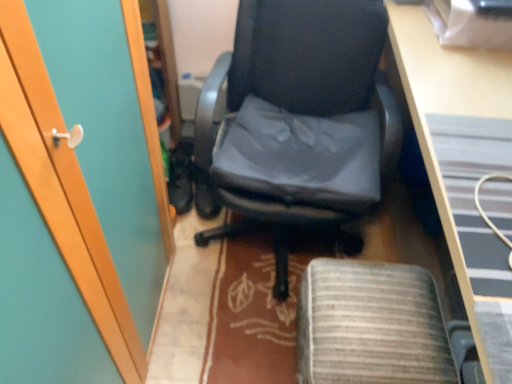
Where is `empty space that is ontop of gray fabric computer chair at center (from a real-world perspective)`? This screenshot has width=512, height=384. empty space that is ontop of gray fabric computer chair at center (from a real-world perspective) is located at coordinates (374, 316).